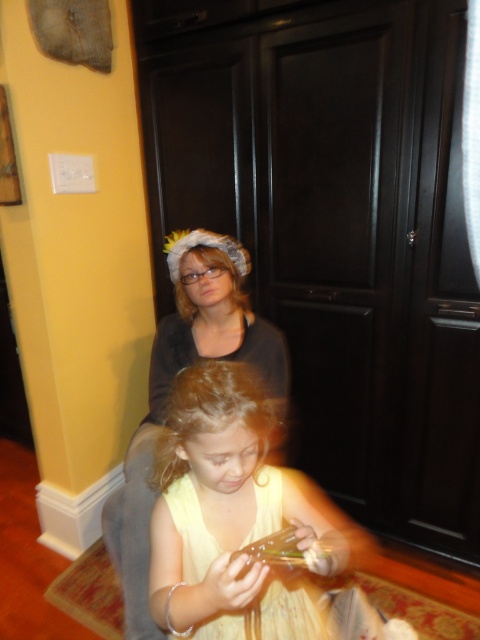
Question: Which point is closer to the camera?

Choices:
 (A) (160, 344)
 (B) (222, 376)
 (C) (181, 284)
 (D) (283, 618)

Answer: (B)

Question: Which point is farther to the camera?

Choices:
 (A) yellow fabric dress at center
 (B) blonde silky hair at upper center
 (C) matte black shirt at upper center
 (D) yellow satin dress at lower center

Answer: (B)

Question: Is the position of matte black shirt at upper center less distant than that of blonde silky hair at upper center?

Choices:
 (A) yes
 (B) no

Answer: (A)

Question: In this image, where is yellow fabric dress at center located relative to yellow satin dress at lower center?

Choices:
 (A) below
 (B) above

Answer: (B)

Question: Among these points, which one is nearest to the camera?

Choices:
 (A) (253, 420)
 (B) (192, 312)

Answer: (A)

Question: Is blonde curly hair at center above blonde silky hair at upper center?

Choices:
 (A) yes
 (B) no

Answer: (B)